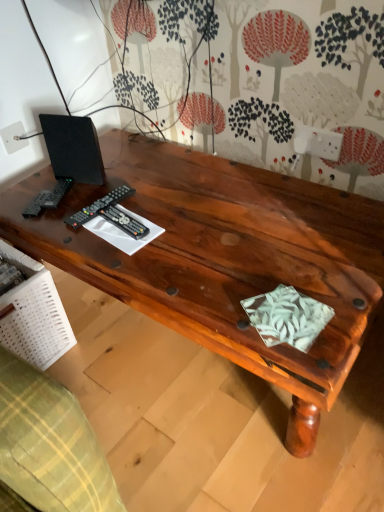
Question: Considering the positions of point (105, 201) and point (173, 224), is point (105, 201) closer or farther from the camera than point (173, 224)?

Choices:
 (A) closer
 (B) farther

Answer: (B)

Question: Considering the positions of black plastic remote at left, which appears as the 1th control when viewed from the left, and shiny brown wood desk at center in the image, is black plastic remote at left, which appears as the 1th control when viewed from the left, bigger or smaller than shiny brown wood desk at center?

Choices:
 (A) small
 (B) big

Answer: (A)

Question: Which of these objects is positioned closest to the black matte speaker at upper left?

Choices:
 (A) black plastic remote at center, acting as the first control starting from the right
 (B) shiny brown wood desk at center
 (C) white plastic electric outlet at upper left
 (D) black plastic remote at left, which appears as the 1th control when viewed from the left

Answer: (D)

Question: Considering the real-world distances, which object is closest to the black plastic remote at center, arranged as the 2th control when viewed from the left?

Choices:
 (A) black matte speaker at upper left
 (B) black plastic remote at left, which appears as the 1th control when viewed from the left
 (C) white plastic electric outlet at upper left
 (D) shiny brown wood desk at center

Answer: (B)